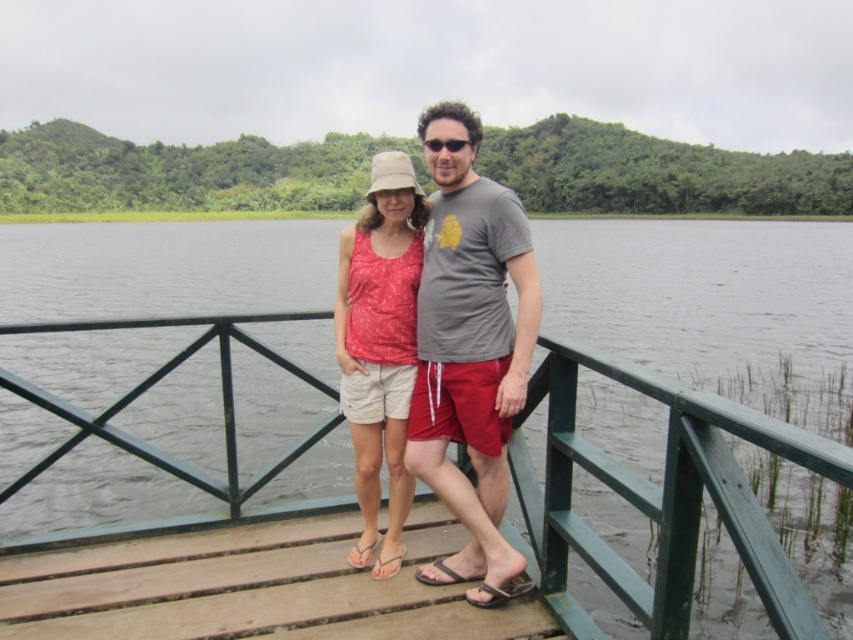
In the scene shown: You are standing 5 feet away from the dock. If you want to reach the green painted wood at center, can you touch it without moving closer?

The green painted wood at center is 5.24 feet away from the viewer. Since you are already 5 feet away, you need to move 0.24 feet closer to touch it.

You are standing on the dock and want to walk towards the end of the dock. You see two points marked on the dock, point (x=424, y=596) and point (x=426, y=145). Which point should you walk towards to reach the end of the dock?

Point (x=424, y=596) is in front of point (x=426, y=145), so you should walk towards point (x=424, y=596) to reach the end of the dock.